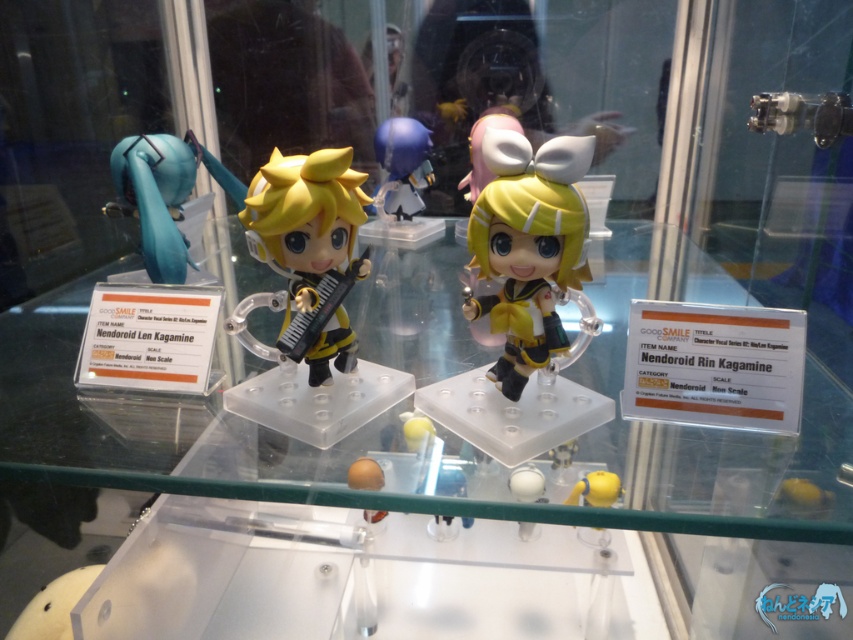
Question: Among these points, which one is nearest to the camera?

Choices:
 (A) (415, 147)
 (B) (254, 198)
 (C) (524, 369)

Answer: (B)

Question: Observing the image, what is the correct spatial positioning of yellow matte nendoroid at center in reference to yellow matte figurine at lower center?

Choices:
 (A) above
 (B) below

Answer: (A)

Question: Does yellow matte nendoroid rin kagamine at center have a lesser width compared to matte blue figure at center?

Choices:
 (A) no
 (B) yes

Answer: (A)

Question: In this image, where is yellow matte figurine at lower center located relative to white matte ball at center?

Choices:
 (A) below
 (B) above

Answer: (A)

Question: Which object is positioned closest to the yellow matte figurine at lower center?

Choices:
 (A) yellow matte nendoroid rin kagamine at center
 (B) white matte ball at center
 (C) yellow matte nendoroid at center
 (D) matte blue figure at center

Answer: (B)

Question: Which object appears farthest from the camera in this image?

Choices:
 (A) yellow matte figurine at lower center
 (B) yellow matte nendoroid rin kagamine at center
 (C) matte blue figure at center
 (D) yellow matte nendoroid at center

Answer: (C)